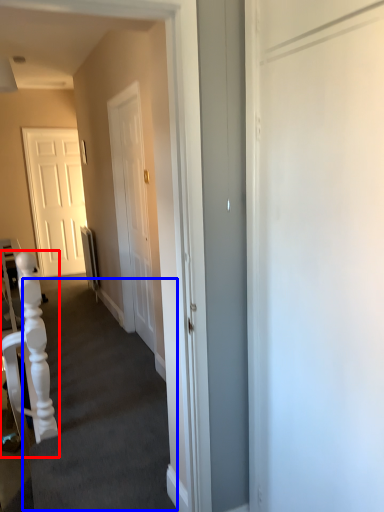
Question: Which object is closer to the camera taking this photo, armchair (highlighted by a red box) or stairwell (highlighted by a blue box)?

Choices:
 (A) armchair
 (B) stairwell

Answer: (B)